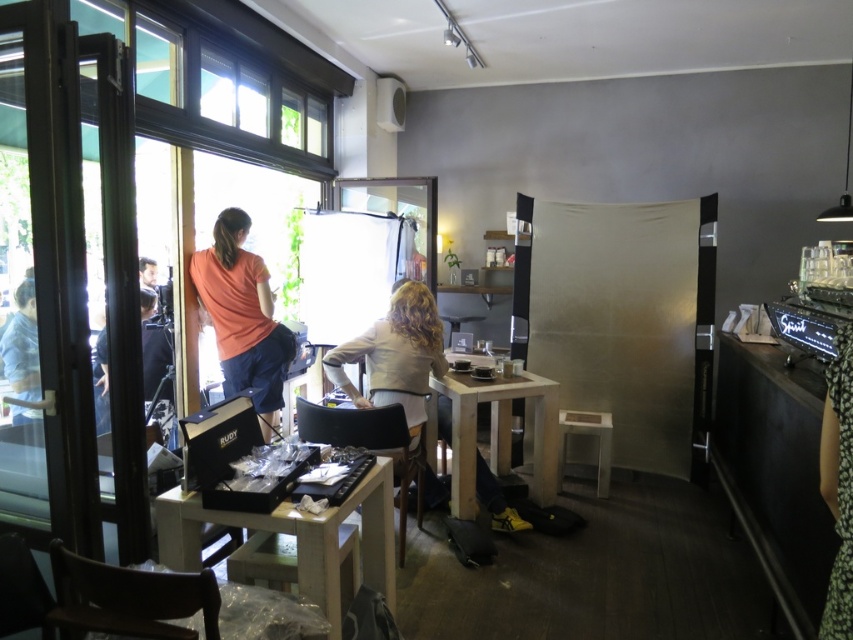
Can you confirm if wooden table at center is shorter than white plastic stool at lower right?

In fact, wooden table at center may be taller than white plastic stool at lower right.

In the scene shown: Is wooden table at center behind white plastic stool at lower right?

No.

Does point (283, 502) come in front of point (569, 413)?

Yes, point (283, 502) is closer to viewer.

You are a GUI agent. You are given a task and a screenshot of the screen. Output one action in this format:
    pyautogui.click(x=<x>, y=<y>)
    Task: Click on the wooden table at center
    This screenshot has height=640, width=853.
    Given the screenshot: What is the action you would take?
    pyautogui.click(x=296, y=534)

Does point (262, 378) come in front of point (599, 493)?

Yes, it is.

Does orange matte shirt at left come in front of white plastic stool at lower right?

Yes, it is in front of white plastic stool at lower right.

Is point (193, 282) positioned in front of point (572, 417)?

Yes, it is.

Where is `orange matte shirt at left`? This screenshot has height=640, width=853. orange matte shirt at left is located at coordinates (242, 316).

Based on the photo, is light wood table at center above white plastic stool at lower right?

Correct, light wood table at center is located above white plastic stool at lower right.

Between point (549, 476) and point (593, 413), which one is positioned in front?

Point (549, 476)

Does point (508, 417) lie behind point (599, 492)?

Yes.

This screenshot has height=640, width=853. I want to click on light wood table at center, so click(496, 432).